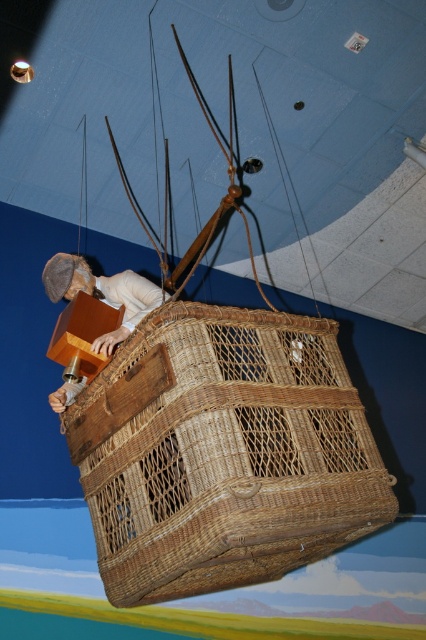
Question: Which object is farther from the camera taking this photo?

Choices:
 (A) woven brown basket at center
 (B) wooden figure at center

Answer: (B)

Question: Which point is closer to the camera?

Choices:
 (A) (62, 408)
 (B) (103, 440)

Answer: (B)

Question: Can you confirm if woven brown basket at center is positioned below wooden figure at center?

Choices:
 (A) yes
 (B) no

Answer: (A)

Question: Is woven brown basket at center in front of wooden figure at center?

Choices:
 (A) no
 (B) yes

Answer: (B)

Question: Which point appears farthest from the camera in this image?

Choices:
 (A) (213, 308)
 (B) (161, 300)

Answer: (B)

Question: Does woven brown basket at center appear over wooden figure at center?

Choices:
 (A) yes
 (B) no

Answer: (B)